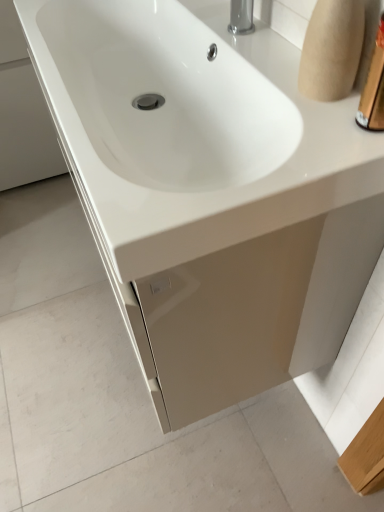
Locate an element on the screen. vacant space to the left of gold metallic container at upper right is located at coordinates (296, 140).